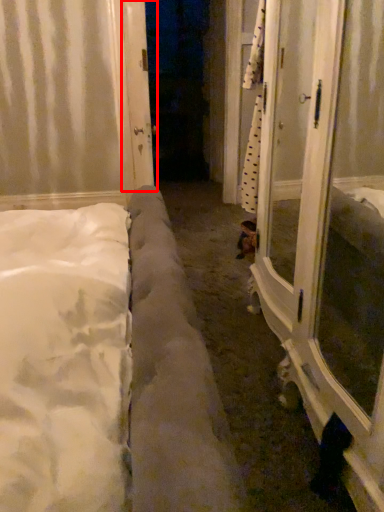
Question: From the image's perspective, what is the correct spatial relationship of door (annotated by the red box) in relation to screen door?

Choices:
 (A) below
 (B) above

Answer: (B)